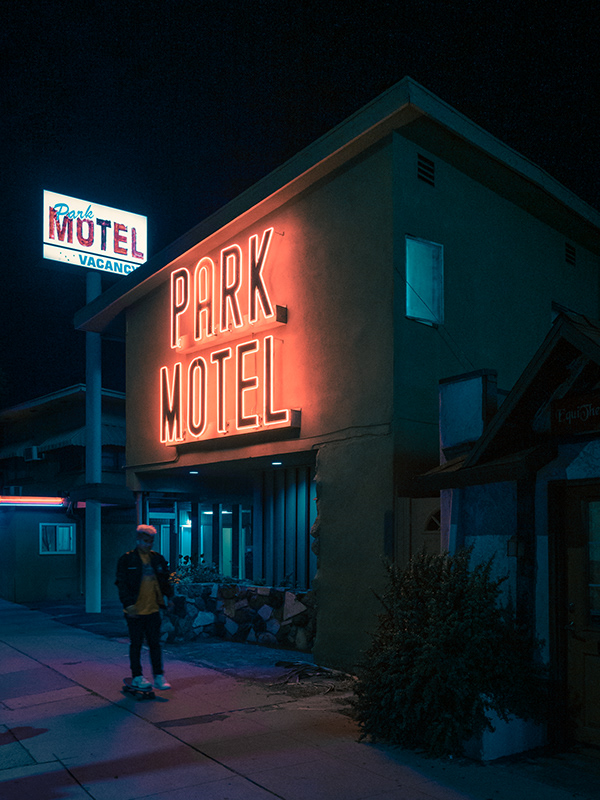
Find the location of a particular element. The height and width of the screenshot is (800, 600). door is located at coordinates (577, 584).